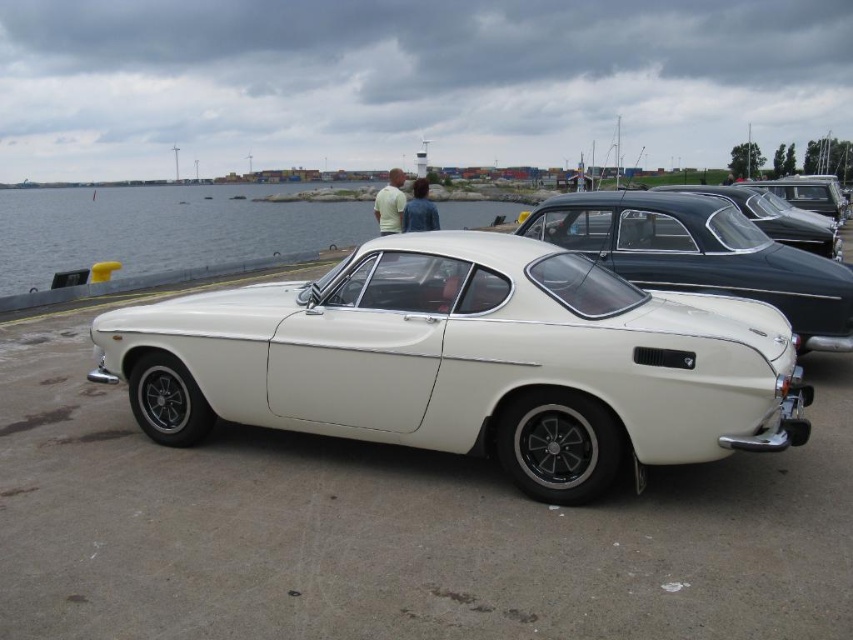
Question: Which of the following is the closest to the observer?

Choices:
 (A) shiny black car at right
 (B) shiny black car at center

Answer: (B)

Question: Is white glossy sports car at center closer to camera compared to white matte car at center?

Choices:
 (A) no
 (B) yes

Answer: (B)

Question: Among these objects, which one is nearest to the camera?

Choices:
 (A) shiny black car at right
 (B) clear water at center
 (C) white glossy sports car at center
 (D) white matte car at center

Answer: (C)

Question: Which of the following is the closest to the observer?

Choices:
 (A) (822, 211)
 (B) (48, 209)
 (C) (788, 292)

Answer: (C)

Question: Can you confirm if clear water at center is thinner than white matte car at center?

Choices:
 (A) no
 (B) yes

Answer: (A)

Question: Is white glossy sports car at center to the left of shiny black car at right from the viewer's perspective?

Choices:
 (A) no
 (B) yes

Answer: (B)